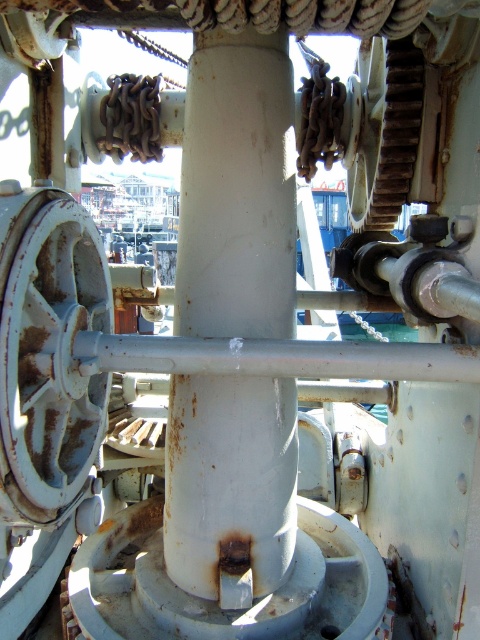
Between rusty metal gear at lower left and rusty metal gear at upper right, which one is positioned higher?

rusty metal gear at upper right

Which is in front, point (84, 211) or point (384, 134)?

Positioned in front is point (84, 211).

Find the location of a particular element. The height and width of the screenshot is (640, 480). rusty metal gear at lower left is located at coordinates [x=48, y=349].